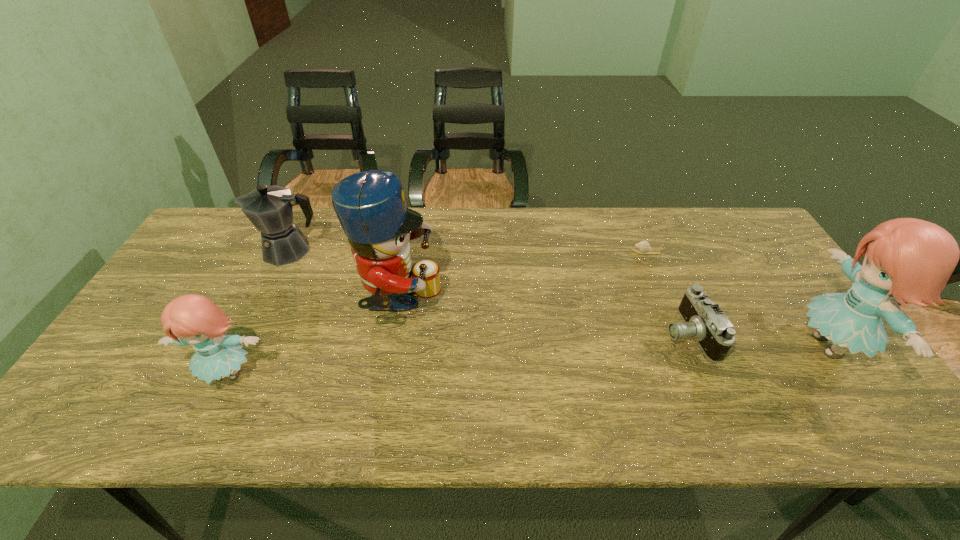
The height and width of the screenshot is (540, 960). In order to click on vacant space located on the shell of the escargot in this screenshot , I will do `click(535, 252)`.

The height and width of the screenshot is (540, 960). In order to click on vacant space located 0.260m on the shell of the escargot in this screenshot , I will do `click(548, 252)`.

Locate an element on the screen. The height and width of the screenshot is (540, 960). vacant space situated on the shell of the escargot is located at coordinates (561, 252).

Identify the location of free space located 0.120m at the spout of the coffeepot. (218, 250).

Where is `free space located 0.380m on the front-facing side of the nutcracker`? Image resolution: width=960 pixels, height=540 pixels. free space located 0.380m on the front-facing side of the nutcracker is located at coordinates (580, 303).

Where is `free space located at the lens of the camera`? Image resolution: width=960 pixels, height=540 pixels. free space located at the lens of the camera is located at coordinates (586, 334).

The image size is (960, 540). Identify the location of free space located at the lens of the camera. (640, 334).

Where is `free space located 0.140m at the lens of the camera`? The image size is (960, 540). free space located 0.140m at the lens of the camera is located at coordinates (609, 334).

You are a GUI agent. You are given a task and a screenshot of the screen. Output one action in this format:
    pyautogui.click(x=<x>, y=<y>)
    Task: Click on the escargot that is at the far edge
    The image size is (960, 540).
    Given the screenshot: What is the action you would take?
    pyautogui.click(x=643, y=247)

In order to click on coffeepot that is at the far edge in this screenshot , I will do `click(269, 209)`.